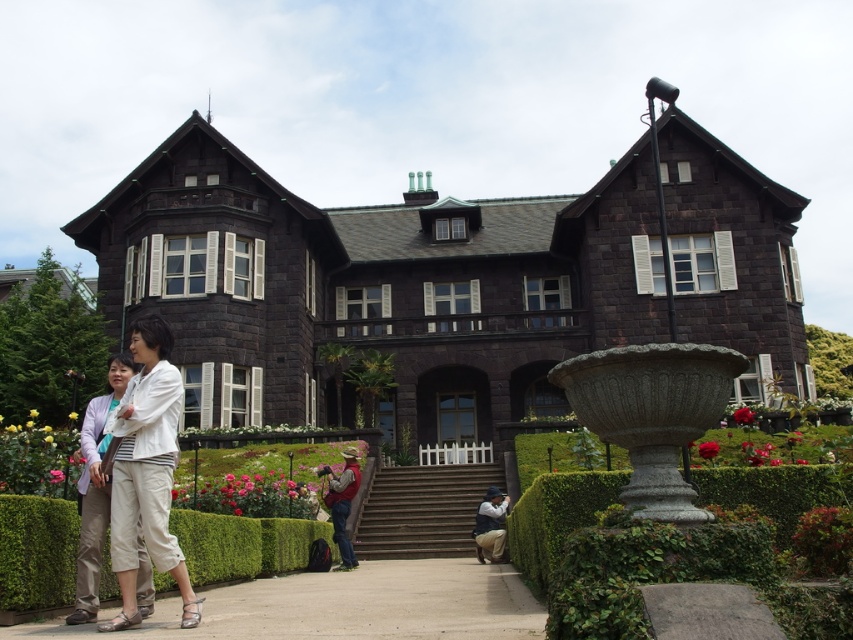
Question: Where is green hedge at center located in relation to rustic brown vest at center in the image?

Choices:
 (A) below
 (B) above

Answer: (B)

Question: Which object is the farthest from the smooth concrete stairs at center?

Choices:
 (A) white cotton pants at lower center
 (B) green hedge at center
 (C) denim jacket at lower center

Answer: (A)

Question: Is green hedge at center further to the viewer compared to white cotton pants at lower center?

Choices:
 (A) yes
 (B) no

Answer: (B)

Question: Is green hedge at center bigger than denim jacket at lower center?

Choices:
 (A) no
 (B) yes

Answer: (B)

Question: Estimate the real-world distances between objects in this image. Which object is farther from the rustic brown vest at center?

Choices:
 (A) denim jacket at lower center
 (B) white cotton pants at lower center
 (C) light beige pants at lower left

Answer: (B)

Question: Which point appears closest to the camera in this image?

Choices:
 (A) (374, 474)
 (B) (354, 458)

Answer: (B)